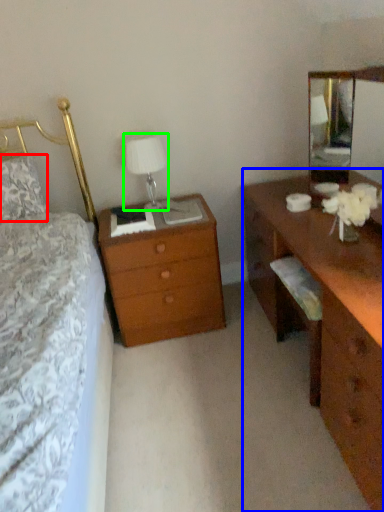
Question: Which object is positioned closest to pillow (highlighted by a red box)? Select from desk (highlighted by a blue box) and table lamp (highlighted by a green box).

Choices:
 (A) desk
 (B) table lamp

Answer: (B)